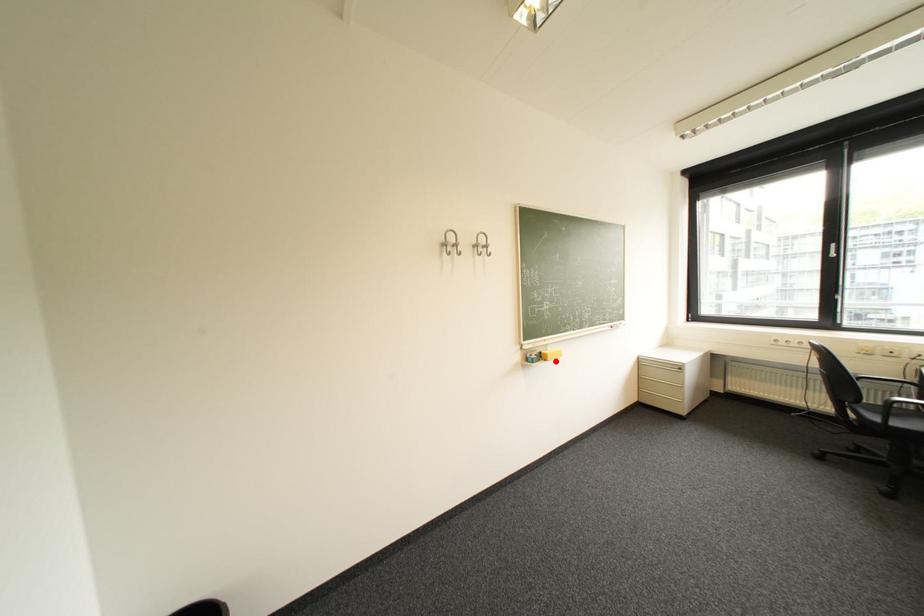
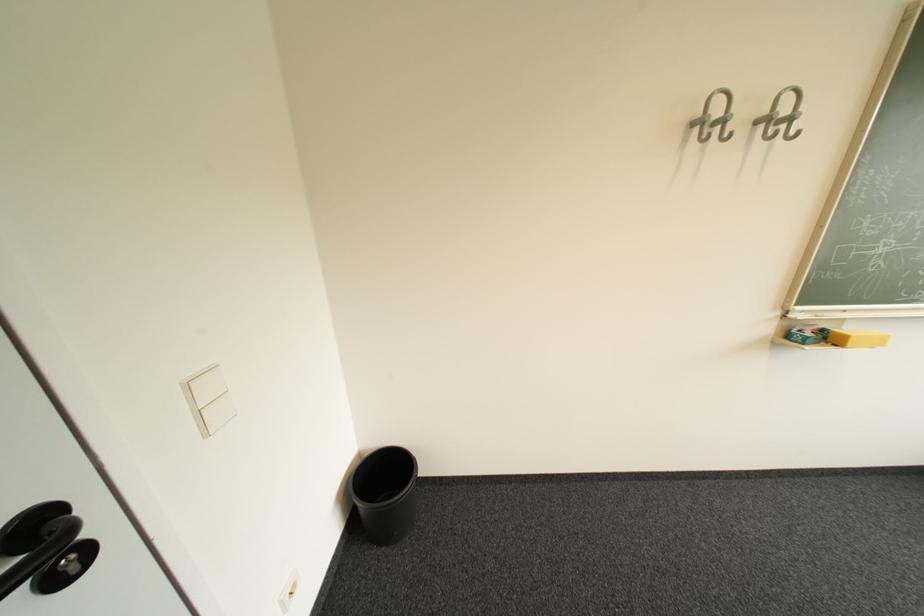
Locate, in the second image, the point that corresponds to the highlighted location in the first image.

(846, 346)